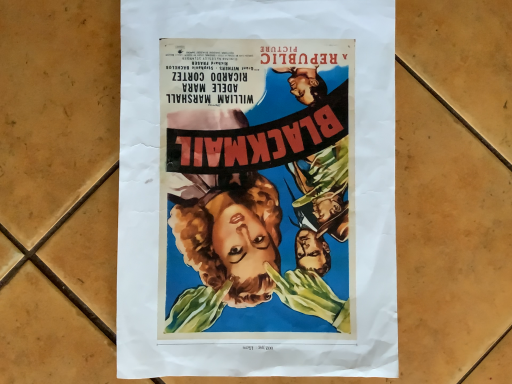
Locate an element on the screen. empty space that is ontop of matte paper poster at center (from a real-world perspective) is located at coordinates (256, 170).